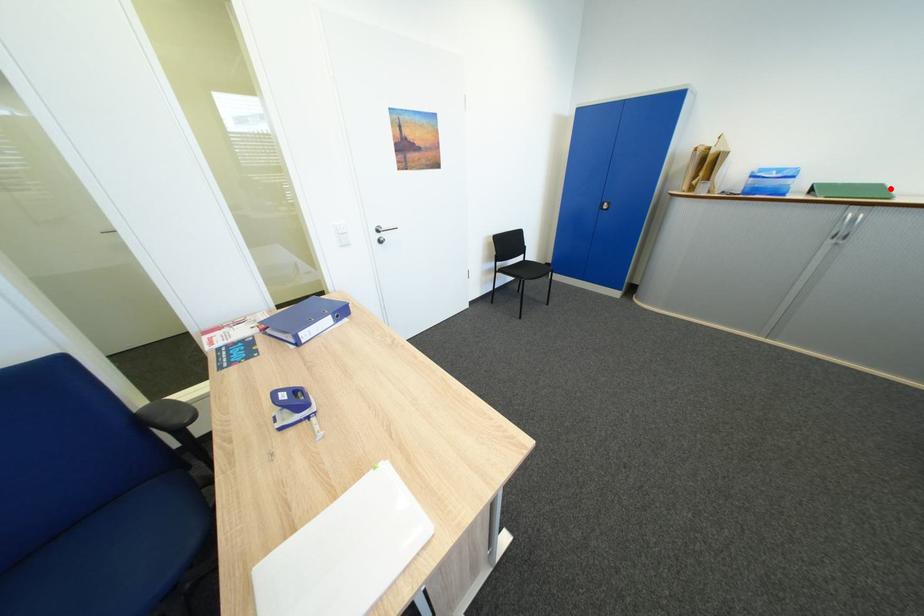
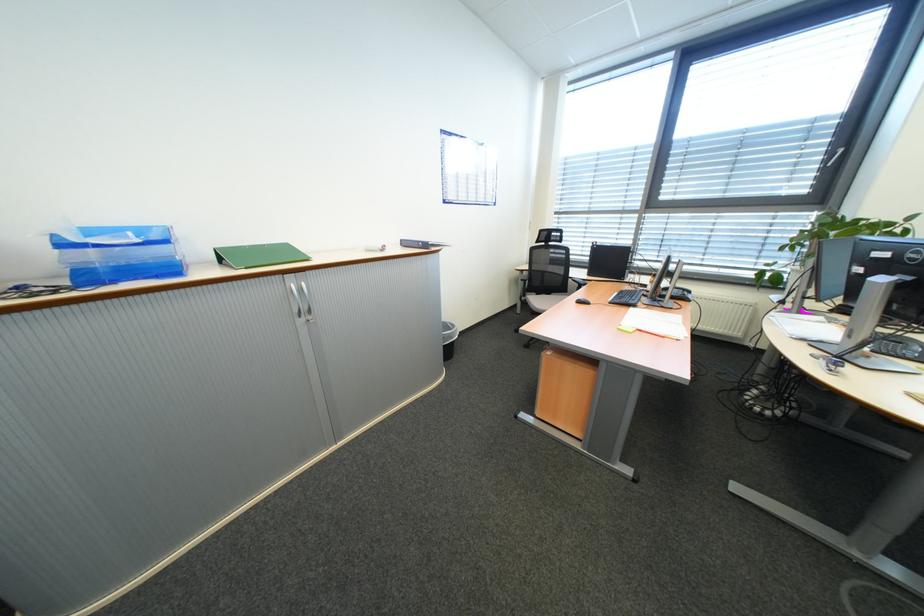
The point at the highlighted location is marked in the first image. Where is the corresponding point in the second image?

(297, 249)